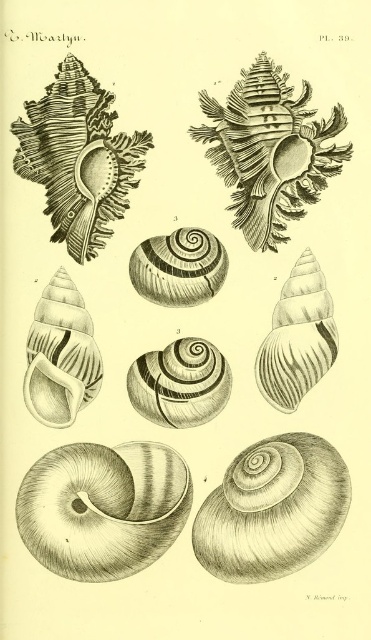
You are a marine biologist examining the image. You need to determine which object has a greater width between the smooth brown shell at bottom left and the smooth brown snail at center. Based on the illustration, which one is wider?

The smooth brown shell at bottom left is wider than the smooth brown snail at center.